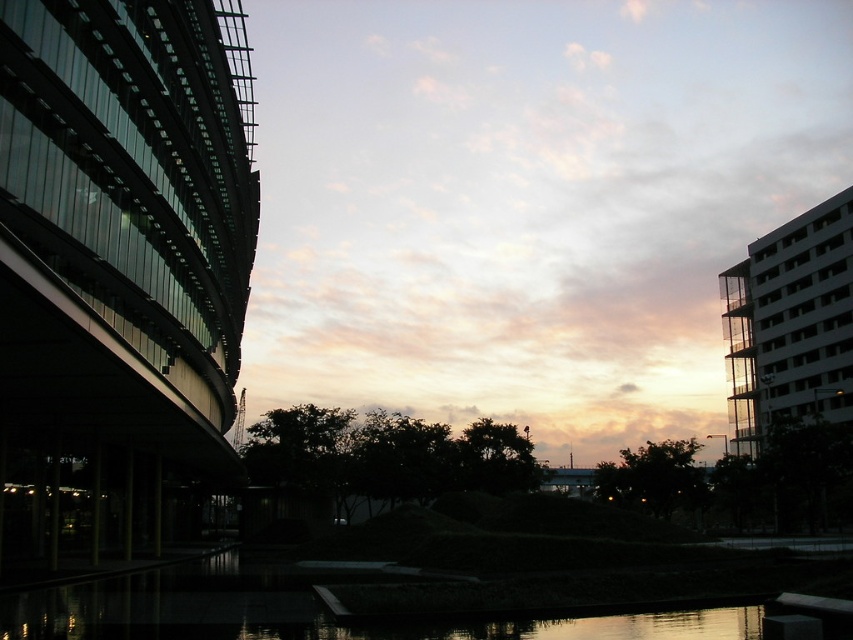
You are an architect designing a new building and want to ensure it complements the existing structures in the scene. Based on the image, which object should you consider in terms of width to align with the pastel sky at center and black reflective water at center?

The pastel sky at center might be wider than black reflective water at center, so you should consider the width of the pastel sky at center to ensure alignment with the existing structures.